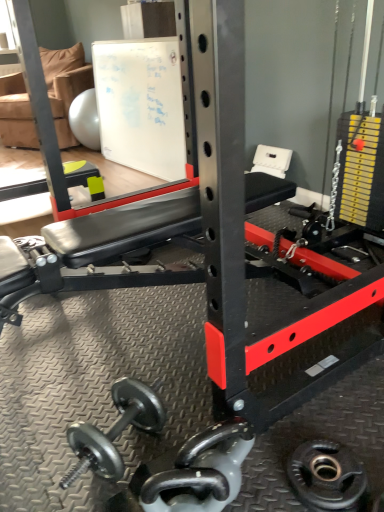
The height and width of the screenshot is (512, 384). What do you see at coordinates (65, 86) in the screenshot?
I see `tan fabric chair at upper left` at bounding box center [65, 86].

Locate an element on the screen. polished silver dumbbell at center is located at coordinates (202, 471).

The height and width of the screenshot is (512, 384). Describe the element at coordinates (327, 477) in the screenshot. I see `black rubber weight plate at lower right` at that location.

Identify the location of white matte board at upper center. This screenshot has height=512, width=384. (141, 105).

Image resolution: width=384 pixels, height=512 pixels. What do you see at coordinates (141, 105) in the screenshot? I see `white matte board at upper center` at bounding box center [141, 105].

Locate an element on the screen. Image resolution: width=384 pixels, height=512 pixels. tan fabric chair at upper left is located at coordinates (65, 86).

Where is `wheel below the polished silver dumbbell at center (from the image's perspective)`? wheel below the polished silver dumbbell at center (from the image's perspective) is located at coordinates (327, 477).

Consider the image. Is polished silver dumbbell at center inside or outside of black rubber weight plate at lower right?

polished silver dumbbell at center lies outside black rubber weight plate at lower right.

Does black rubber weight plate at lower right appear on the left side of polished silver dumbbell at center?

No, black rubber weight plate at lower right is not to the left of polished silver dumbbell at center.

Which is in front, point (304, 477) or point (176, 485)?

The point (176, 485) is more forward.

Where is `wheel lying on the right of polished silver dumbbell at center`? The height and width of the screenshot is (512, 384). wheel lying on the right of polished silver dumbbell at center is located at coordinates (327, 477).

From the image's perspective, is black rubber weight plate at lower right above or below polished silver dumbbell at center?

black rubber weight plate at lower right is below polished silver dumbbell at center.

From a real-world perspective, is black rubber weight plate at lower right on white matte board at upper center?

No.

Considering the points (314, 444) and (128, 92), which point is behind, point (314, 444) or point (128, 92)?

The point (128, 92) is behind.

Considering the sizes of black rubber weight plate at lower right and white matte board at upper center in the image, is black rubber weight plate at lower right wider or thinner than white matte board at upper center?

black rubber weight plate at lower right is thinner than white matte board at upper center.

Identify the location of wheel on the right of white matte board at upper center. Image resolution: width=384 pixels, height=512 pixels. (327, 477).

From a real-world perspective, which object stands above the other?

In real-world perspective, tan fabric chair at upper left is above.

Is tan fabric chair at upper left positioned with its back to black rubber weight plate at lower right?

No, tan fabric chair at upper left is not facing the opposite direction of black rubber weight plate at lower right.

In order to click on chair behind the black rubber weight plate at lower right in this screenshot , I will do (x=65, y=86).

Is tan fabric chair at upper left thinner than black rubber weight plate at lower right?

No, tan fabric chair at upper left is not thinner than black rubber weight plate at lower right.

Is polished silver dumbbell at center not within white matte board at upper center?

Indeed, polished silver dumbbell at center is completely outside white matte board at upper center.

In the scene shown: Which is more to the left, polished silver dumbbell at center or white matte board at upper center?

white matte board at upper center.

Which of these two, polished silver dumbbell at center or white matte board at upper center, is bigger?

Bigger between the two is white matte board at upper center.

Would you say polished silver dumbbell at center contains tan fabric chair at upper left?

No, tan fabric chair at upper left is located outside of polished silver dumbbell at center.

From a real-world perspective, is polished silver dumbbell at center over tan fabric chair at upper left?

No, from a real-world perspective, polished silver dumbbell at center is not on top of tan fabric chair at upper left.

Is polished silver dumbbell at center far from tan fabric chair at upper left?

Yes, polished silver dumbbell at center and tan fabric chair at upper left are located far from each other.

From the picture: What's the angular difference between black rubber weight plate at lower right and tan fabric chair at upper left's facing directions?

The facing directions of black rubber weight plate at lower right and tan fabric chair at upper left are 31.8 degrees apart.

Does point (326, 441) lie in front of point (50, 87)?

Yes, it is.

Are black rubber weight plate at lower right and tan fabric chair at upper left beside each other?

No, black rubber weight plate at lower right is not making contact with tan fabric chair at upper left.

Considering the relative positions of black rubber weight plate at lower right and tan fabric chair at upper left in the image provided, is black rubber weight plate at lower right to the left of tan fabric chair at upper left from the viewer's perspective?

No, black rubber weight plate at lower right is not to the left of tan fabric chair at upper left.

Where is `dumbbell in front of the black rubber weight plate at lower right`? The image size is (384, 512). dumbbell in front of the black rubber weight plate at lower right is located at coordinates (202, 471).

At what (x,y) coordinates should I click in order to perform the action: click on wheel that is under the polished silver dumbbell at center (from a real-world perspective). Please return your answer as a coordinate pair (x, y). The image size is (384, 512). Looking at the image, I should click on (327, 477).

From the image, which object appears to be farther from polished silver dumbbell at center, white matte board at upper center or black rubber weight plate at lower right?

Among the two, white matte board at upper center is located further to polished silver dumbbell at center.

From the image, which object appears to be farther from polished silver dumbbell at center, tan fabric chair at upper left or black rubber weight plate at lower right?

tan fabric chair at upper left lies further to polished silver dumbbell at center than the other object.

From the image, which object appears to be nearer to black rubber weight plate at lower right, white matte board at upper center or tan fabric chair at upper left?

The object closer to black rubber weight plate at lower right is white matte board at upper center.

Estimate the real-world distances between objects in this image. Which object is closer to white matte board at upper center, black rubber weight plate at lower right or polished silver dumbbell at center?

Among the two, polished silver dumbbell at center is located nearer to white matte board at upper center.

Looking at the image, which one is located further to tan fabric chair at upper left, polished silver dumbbell at center or white matte board at upper center?

The object further to tan fabric chair at upper left is polished silver dumbbell at center.

In the scene shown: Looking at the image, which one is located closer to tan fabric chair at upper left, white matte board at upper center or black rubber weight plate at lower right?

white matte board at upper center.

Estimate the real-world distances between objects in this image. Which object is closer to white matte board at upper center, polished silver dumbbell at center or tan fabric chair at upper left?

tan fabric chair at upper left.

Considering their positions, is polished silver dumbbell at center positioned further to black rubber weight plate at lower right than tan fabric chair at upper left?

tan fabric chair at upper left is positioned further to the anchor black rubber weight plate at lower right.

You are a GUI agent. You are given a task and a screenshot of the screen. Output one action in this format:
    pyautogui.click(x=<x>, y=<y>)
    Task: Click on the wheel positioned between polished silver dumbbell at center and tan fabric chair at upper left from near to far
    The width and height of the screenshot is (384, 512).
    Given the screenshot: What is the action you would take?
    pyautogui.click(x=327, y=477)

Where is `bulletin board positioned between black rubber weight plate at lower right and tan fabric chair at upper left from near to far`? This screenshot has height=512, width=384. bulletin board positioned between black rubber weight plate at lower right and tan fabric chair at upper left from near to far is located at coordinates (141, 105).

Where is `wheel positioned between polished silver dumbbell at center and white matte board at upper center from near to far`? Image resolution: width=384 pixels, height=512 pixels. wheel positioned between polished silver dumbbell at center and white matte board at upper center from near to far is located at coordinates (327, 477).

Locate an element on the screen. The width and height of the screenshot is (384, 512). bulletin board located between polished silver dumbbell at center and tan fabric chair at upper left in the depth direction is located at coordinates (141, 105).